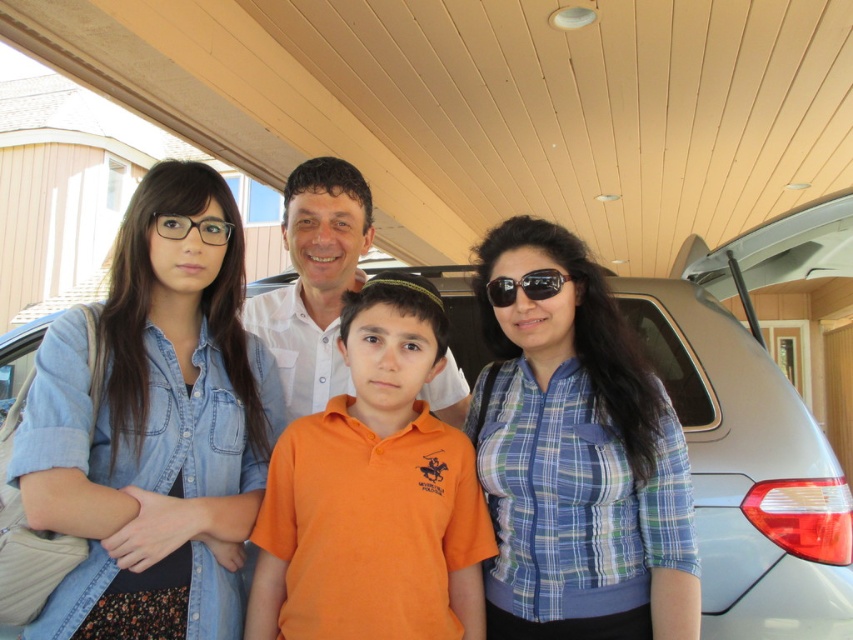
You are a delivery person who needs to load a package onto the satin silver car at center. The package requires a height clearance of 1.5 meters. Can you determine if the clear plastic glasses at upper left will interfere with the loading process?

The satin silver car at center is much taller than the clear plastic glasses at upper left, so the glasses are unlikely to interfere with loading the package onto the car as long as they are not placed in the loading area.

You are a photographer trying to capture a clear shot of the orange cotton shirt at center and the sunglasses at center. Since the subjects are standing close together, you need to adjust your focus. Which object should you focus on first to ensure it appears sharp in the photo?

The orange cotton shirt at center is positioned under sunglasses at center, so you should focus on the sunglasses at center first to ensure it stays sharp as it is closer to the camera.

You are trying to determine if the orange cotton shirt at center can fully cover the sunglasses at center if placed over it. Based on their sizes, is this possible?

The orange cotton shirt at center might be wider than sunglasses at center, so it could potentially cover them fully depending on how it is positioned.